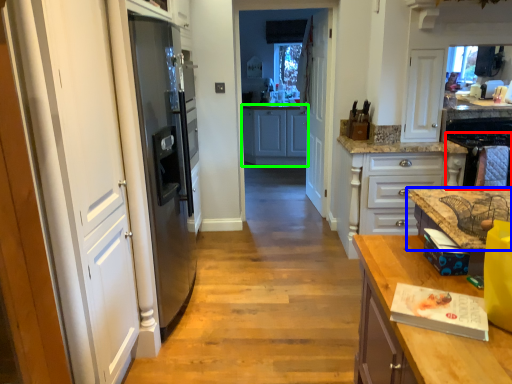
Question: Estimate the real-world distances between objects in this image. Which object is farther from oven (highlighted by a red box), countertop (highlighted by a blue box) or cabinetry (highlighted by a green box)?

Choices:
 (A) countertop
 (B) cabinetry

Answer: (B)